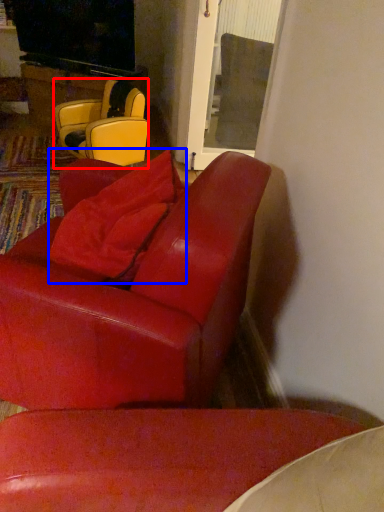
Question: Which object is closer to the camera taking this photo, chair (highlighted by a red box) or pillow (highlighted by a blue box)?

Choices:
 (A) chair
 (B) pillow

Answer: (B)